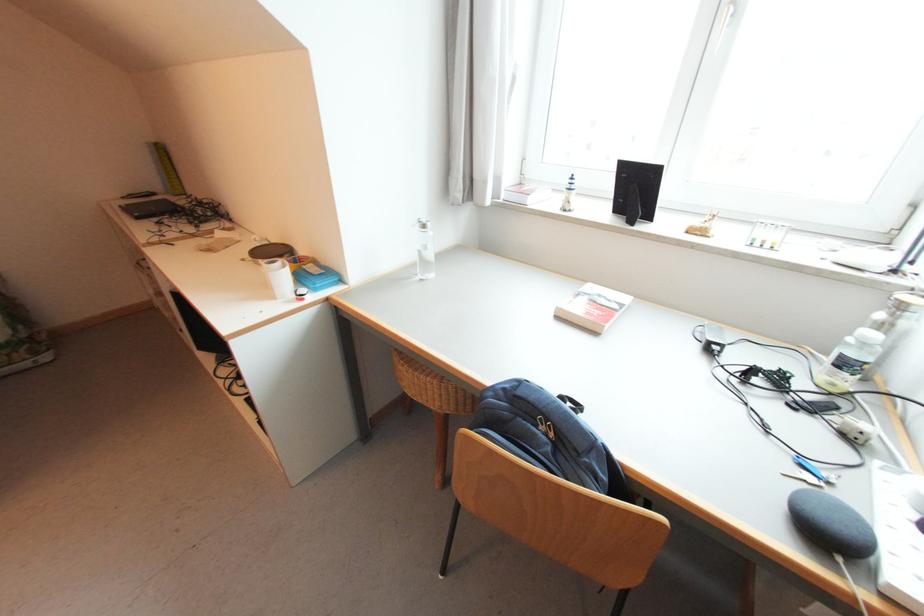
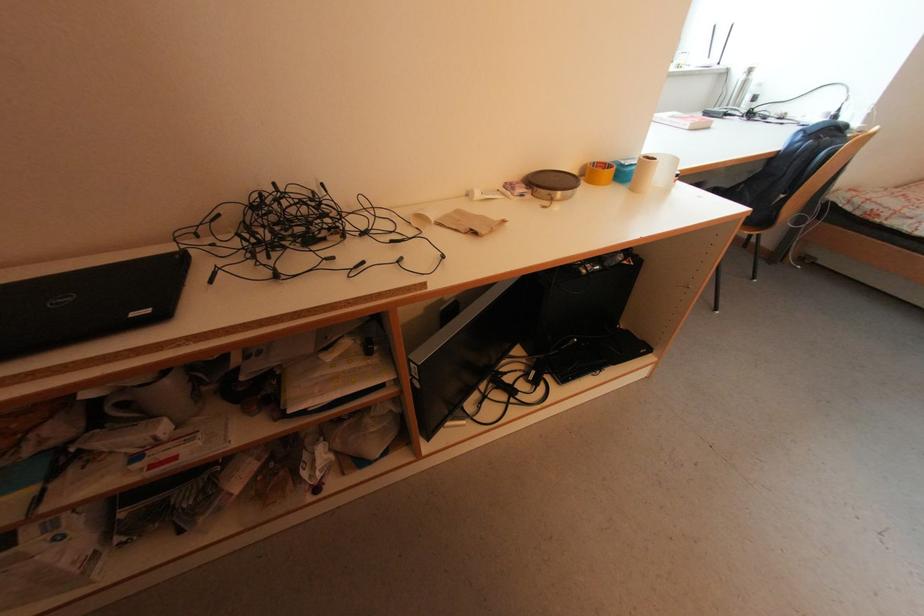
Where in the second image is the point corresponding to pixel 143 219 from the first image?

(168, 317)